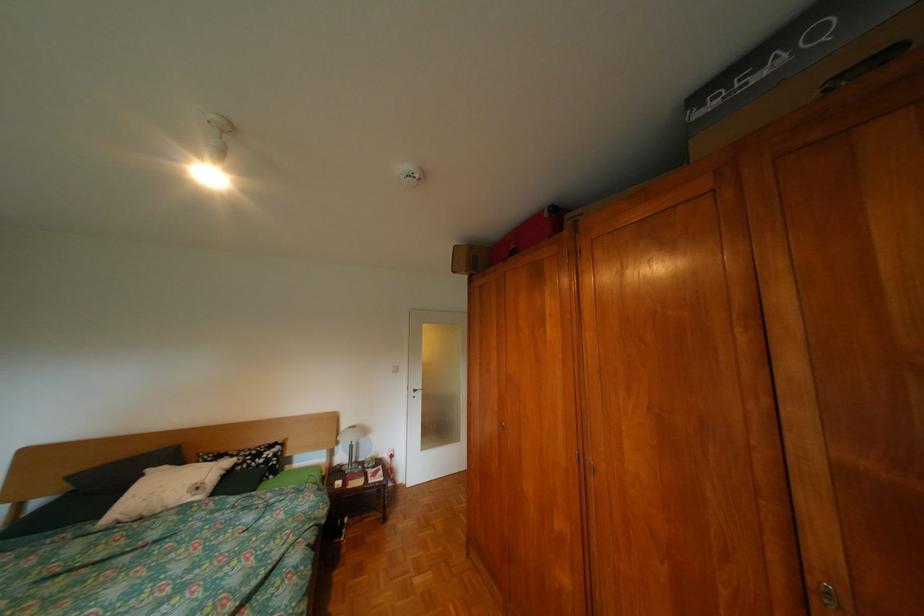
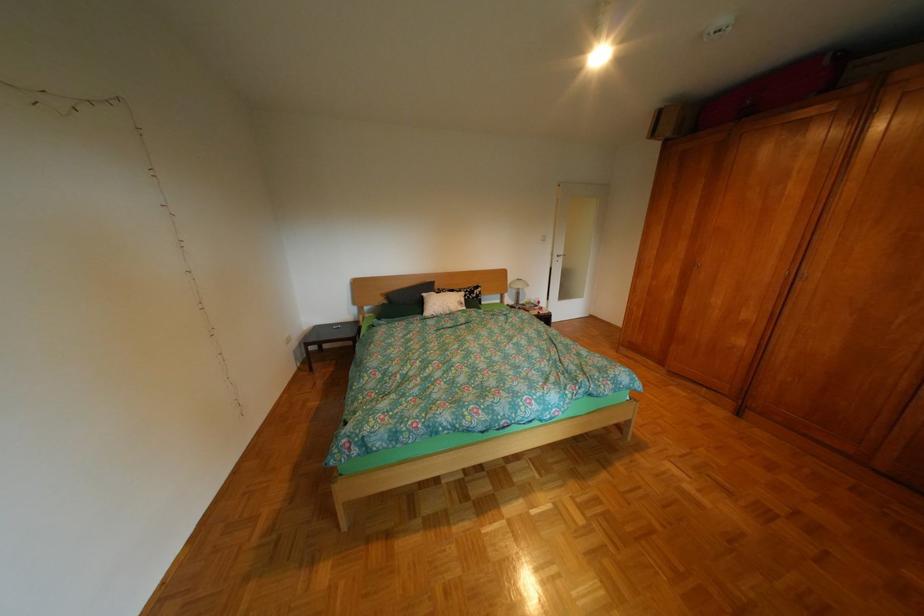
What movement of the cameraman would produce the second image?

The movement direction of the cameraman is left, backward.